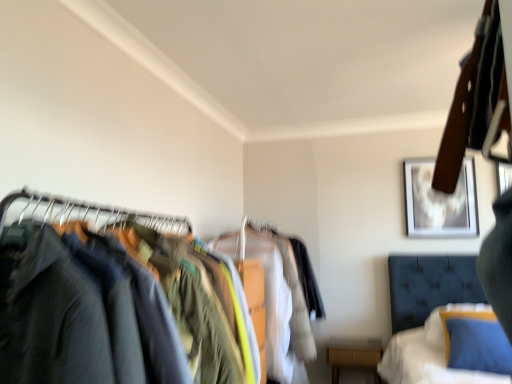
Question: Is velvet blue bed at lower right positioned beyond the bounds of white cotton shirt at center, acting as the 2th clothing starting from the front?

Choices:
 (A) yes
 (B) no

Answer: (A)

Question: Is there a large distance between velvet blue bed at lower right and white cotton shirt at center, acting as the 2th clothing starting from the front?

Choices:
 (A) no
 (B) yes

Answer: (A)

Question: Is white cotton shirt at center, the first clothing when ordered from back to front, located within velvet blue bed at lower right?

Choices:
 (A) yes
 (B) no

Answer: (B)

Question: Considering the relative sizes of velvet blue bed at lower right and white cotton shirt at center, the first clothing when ordered from back to front, in the image provided, is velvet blue bed at lower right taller than white cotton shirt at center, the first clothing when ordered from back to front,?

Choices:
 (A) yes
 (B) no

Answer: (B)

Question: Considering the relative positions of velvet blue bed at lower right and white cotton shirt at center, the first clothing when ordered from back to front, in the image provided, is velvet blue bed at lower right behind white cotton shirt at center, the first clothing when ordered from back to front,?

Choices:
 (A) yes
 (B) no

Answer: (A)

Question: Is the surface of velvet blue bed at lower right in direct contact with white cotton shirt at center, the first clothing when ordered from back to front?

Choices:
 (A) yes
 (B) no

Answer: (B)

Question: Is metallic silver picture frame at upper right, the first picture frame viewed from the right, wider than wooden framed artwork at upper right, which ranks as the 2th picture frame in right-to-left order?

Choices:
 (A) yes
 (B) no

Answer: (A)

Question: Is metallic silver picture frame at upper right, the first picture frame viewed from the right, to the right of wooden framed artwork at upper right, marked as the 1th picture frame in a left-to-right arrangement, from the viewer's perspective?

Choices:
 (A) no
 (B) yes

Answer: (B)

Question: From the image's perspective, is metallic silver picture frame at upper right, positioned as the 2th picture frame in left-to-right order, under wooden framed artwork at upper right, which ranks as the 2th picture frame in right-to-left order?

Choices:
 (A) no
 (B) yes

Answer: (A)

Question: Can you confirm if metallic silver picture frame at upper right, the first picture frame viewed from the right, is thinner than wooden framed artwork at upper right, marked as the 1th picture frame in a left-to-right arrangement?

Choices:
 (A) yes
 (B) no

Answer: (B)

Question: Is metallic silver picture frame at upper right, positioned as the 2th picture frame in left-to-right order, next to wooden framed artwork at upper right, which ranks as the 2th picture frame in right-to-left order, and touching it?

Choices:
 (A) yes
 (B) no

Answer: (B)

Question: Is wooden framed artwork at upper right, marked as the 1th picture frame in a left-to-right arrangement, at the back of metallic silver picture frame at upper right, positioned as the 2th picture frame in left-to-right order?

Choices:
 (A) no
 (B) yes

Answer: (A)

Question: Does wooden framed artwork at upper right, which ranks as the 2th picture frame in right-to-left order, appear on the left side of dark blue fabric at left?

Choices:
 (A) no
 (B) yes

Answer: (A)